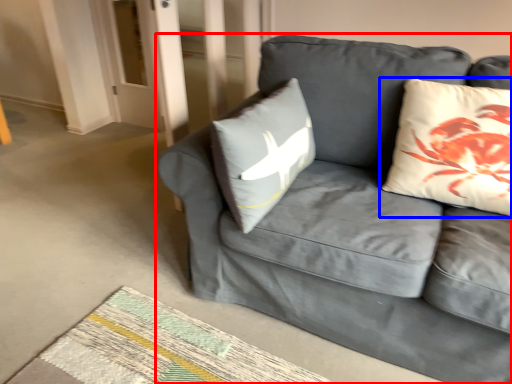
Question: Among these objects, which one is farthest to the camera, studio couch (highlighted by a red box) or pillow (highlighted by a blue box)?

Choices:
 (A) studio couch
 (B) pillow

Answer: (B)